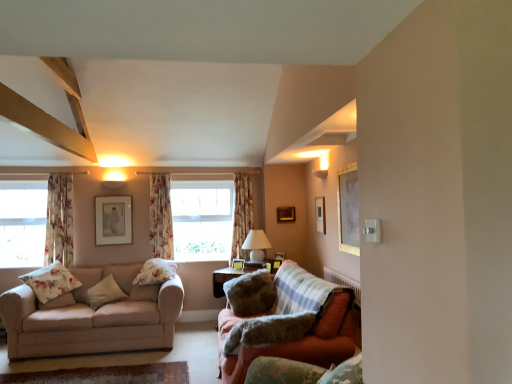
Question: From a real-world perspective, is velvet green armchair at lower right beneath fluffy beige pillow at left, the second pillow viewed from the left?

Choices:
 (A) no
 (B) yes

Answer: (A)

Question: Is velvet green armchair at lower right shorter than fluffy beige pillow at left, the second pillow viewed from the left?

Choices:
 (A) no
 (B) yes

Answer: (A)

Question: Is fluffy beige pillow at left, the second pillow viewed from the left, inside velvet green armchair at lower right?

Choices:
 (A) no
 (B) yes

Answer: (A)

Question: Is velvet green armchair at lower right closer to the viewer compared to fluffy beige pillow at left, the second pillow viewed from the left?

Choices:
 (A) yes
 (B) no

Answer: (A)

Question: Is velvet green armchair at lower right smaller than fluffy beige pillow at left, the fifth pillow positioned from the right?

Choices:
 (A) yes
 (B) no

Answer: (B)

Question: Does point (258, 312) appear closer or farther from the camera than point (234, 264)?

Choices:
 (A) closer
 (B) farther

Answer: (A)

Question: Do you think fluffy beige pillow at center, the second pillow viewed from the right, is within wooden picture frame at center, marked as the fourth picture frame in a front-to-back arrangement, or outside of it?

Choices:
 (A) inside
 (B) outside

Answer: (B)

Question: Based on their positions, is fluffy beige pillow at center, the second pillow viewed from the right, located to the left or right of wooden picture frame at center, positioned as the 5th picture frame in right-to-left order?

Choices:
 (A) left
 (B) right

Answer: (B)

Question: Considering their positions, is fluffy beige pillow at center, which is counted as the 5th pillow, starting from the left, located in front of or behind wooden picture frame at center, positioned as the 5th picture frame in right-to-left order?

Choices:
 (A) front
 (B) behind

Answer: (A)

Question: From the image's perspective, is wooden picture frame at upper center, which is counted as the 6th picture frame, starting from the back, located above or below beige fabric pillow at left, the 3th pillow in the left-to-right sequence?

Choices:
 (A) below
 (B) above

Answer: (B)

Question: Is wooden picture frame at upper center, which is counted as the 6th picture frame, starting from the back, situated inside beige fabric pillow at left, the 3th pillow in the left-to-right sequence, or outside?

Choices:
 (A) inside
 (B) outside

Answer: (B)

Question: Considering the positions of point (320, 226) and point (117, 297), is point (320, 226) closer or farther from the camera than point (117, 297)?

Choices:
 (A) farther
 (B) closer

Answer: (A)

Question: Considering the relative positions of wooden picture frame at upper center, which is counted as the 6th picture frame, starting from the back, and beige fabric pillow at left, marked as the fourth pillow in a right-to-left arrangement, in the image provided, is wooden picture frame at upper center, which is counted as the 6th picture frame, starting from the back, to the left or to the right of beige fabric pillow at left, marked as the fourth pillow in a right-to-left arrangement,?

Choices:
 (A) right
 (B) left

Answer: (A)

Question: From a real-world perspective, is transparent glass window at left above or below floral fabric pillow at center, arranged as the fourth pillow when viewed from the left?

Choices:
 (A) below
 (B) above

Answer: (B)

Question: Which is correct: transparent glass window at left is inside floral fabric pillow at center, the third pillow from the right, or outside of it?

Choices:
 (A) outside
 (B) inside

Answer: (A)